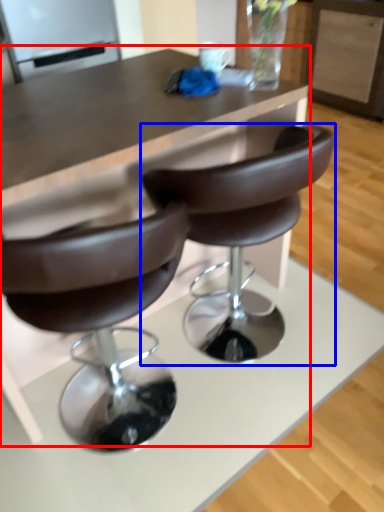
Question: Which of the following is the farthest to the observer, table (highlighted by a red box) or chair (highlighted by a blue box)?

Choices:
 (A) table
 (B) chair

Answer: (B)